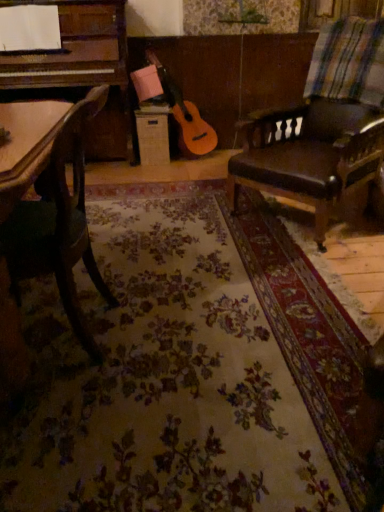
At what (x,y) coordinates should I click in order to perform the action: click on free point in front of leather cushioned chair at right, the second chair positioned from the left. Please return your answer as a coordinate pair (x, y). Image resolution: width=384 pixels, height=512 pixels. Looking at the image, I should click on (299, 270).